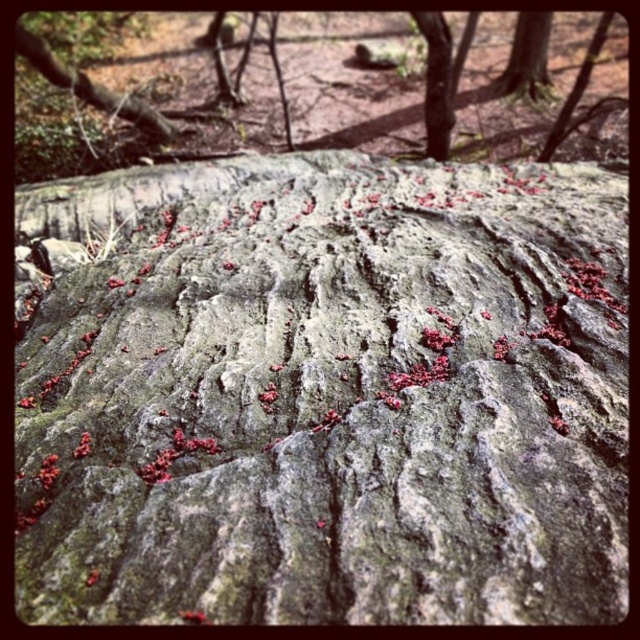
You are standing in a serene outdoor area with a large rock in front of you. You see a point marked at coordinates point (19,61). Can you estimate how far this point is from your current position?

The point (19,61) is 29.16 meters away from the viewer, so the distance is approximately 29.16 meters.

You are a hiker standing at the base of the rough bark tree trunk at center. You want to place a 20 meter long rope from your current position to the top of the trunk. Is the rope long enough?

The rough bark tree trunk at center is 17.56 meters from viewer. Since the rope is 20 meters long, which is longer than the distance to the trunk, the rope is long enough to reach from your current position to the top of the trunk.

You are a hiker trying to cross a narrow path between the green mossy rock at center and the rough bark tree trunk at center. The path is only 0.8 meters wide. Can you safely walk through it if you need 1 meter of width?

The green mossy rock at center has a lesser width compared to rough bark tree trunk at center. Since the path is only 0.8 meters wide, which is narrower than the 1 meter required, you cannot safely walk through it.